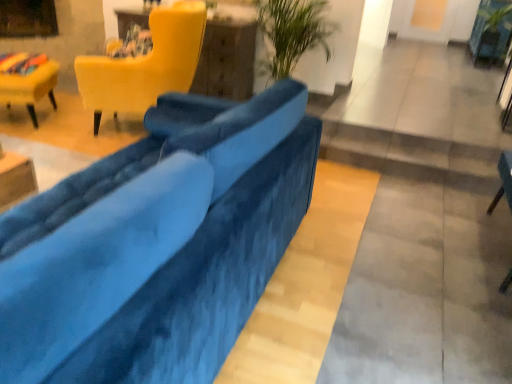
Measure the distance between point (481, 9) and camera.

Point (481, 9) is 6.29 meters away from camera.

Describe the element at coordinates (146, 64) in the screenshot. I see `velvet yellow chair at upper left, which is the 2th chair in left-to-right order` at that location.

What is the approximate height of velvet blue couch at center?

It is 92.53 centimeters.

Locate an element on the screen. The height and width of the screenshot is (384, 512). green leafy plant at upper right is located at coordinates (495, 17).

Consider the image. From their relative heights in the image, would you say velvet yellow chair at upper left, which is the 2th chair in left-to-right order, is taller or shorter than green leafy plant at upper right?

velvet yellow chair at upper left, which is the 2th chair in left-to-right order, is taller than green leafy plant at upper right.

From a real-world perspective, does velvet yellow chair at upper left, which is the 2th chair in left-to-right order, sit lower than green leafy plant at upper right?

Yes, from a real-world perspective, velvet yellow chair at upper left, which is the 2th chair in left-to-right order, is below green leafy plant at upper right.

In the scene shown: Is velvet yellow chair at upper left, which is the second chair from right to left, to the right of green leafy plant at upper right from the viewer's perspective?

In fact, velvet yellow chair at upper left, which is the second chair from right to left, is to the left of green leafy plant at upper right.

Locate an element on the screen. Image resolution: width=512 pixels, height=384 pixels. the 2nd chair in front when counting from the green leafy plant at upper right is located at coordinates (146, 64).

Would you say velvet blue chair at lower right, acting as the third chair starting from the left, is outside matte yellow chair at upper left?

Yes, velvet blue chair at lower right, acting as the third chair starting from the left, is located beyond the bounds of matte yellow chair at upper left.

Is velvet blue chair at lower right, acting as the third chair starting from the left, beside matte yellow chair at upper left?

No, velvet blue chair at lower right, acting as the third chair starting from the left, is not touching matte yellow chair at upper left.

Is velvet blue chair at lower right, acting as the first chair starting from the right, oriented away from matte yellow chair at upper left?

velvet blue chair at lower right, acting as the first chair starting from the right, does not have its back to matte yellow chair at upper left.

Considering the positions of objects velvet blue chair at lower right, acting as the first chair starting from the right, and matte yellow chair at upper left in the image provided, who is in front, velvet blue chair at lower right, acting as the first chair starting from the right, or matte yellow chair at upper left?

velvet blue chair at lower right, acting as the first chair starting from the right, is in front.

Are velvet yellow chair at left, arranged as the third chair when viewed from the right, and velvet blue chair at lower right, acting as the first chair starting from the right, located far from each other?

velvet yellow chair at left, arranged as the third chair when viewed from the right, is positioned a significant distance from velvet blue chair at lower right, acting as the first chair starting from the right.

From the image's perspective, is velvet yellow chair at left, arranged as the third chair when viewed from the right, on velvet blue chair at lower right, acting as the first chair starting from the right?

Yes, from the image's perspective, velvet yellow chair at left, arranged as the third chair when viewed from the right, is over velvet blue chair at lower right, acting as the first chair starting from the right.

Measure the distance between velvet yellow chair at left, arranged as the 1th chair when viewed from the left, and velvet blue chair at lower right, acting as the first chair starting from the right.

They are 3.72 meters apart.

Is velvet yellow chair at left, arranged as the 1th chair when viewed from the left, aimed at velvet blue chair at lower right, acting as the third chair starting from the left?

No, velvet yellow chair at left, arranged as the 1th chair when viewed from the left, is not aimed at velvet blue chair at lower right, acting as the third chair starting from the left.

From the matte yellow chair at upper left, count the 1st chair to the left and point to it. Please provide its 2D coordinates.

[(146, 64)]

Can matte yellow chair at upper left be found inside velvet yellow chair at upper left, which is the second chair from right to left?

No, matte yellow chair at upper left is not a part of velvet yellow chair at upper left, which is the second chair from right to left.

Does velvet yellow chair at upper left, which is the 2th chair in left-to-right order, turn towards matte yellow chair at upper left?

No, velvet yellow chair at upper left, which is the 2th chair in left-to-right order, is not aimed at matte yellow chair at upper left.

How many degrees apart are the facing directions of velvet yellow chair at upper left, which is the 2th chair in left-to-right order, and matte yellow chair at upper left?

The facing directions of velvet yellow chair at upper left, which is the 2th chair in left-to-right order, and matte yellow chair at upper left are 67.5 degrees apart.

From the image's perspective, relative to matte yellow chair at upper left, is velvet yellow chair at left, arranged as the 1th chair when viewed from the left, above or below?

From the image's perspective, velvet yellow chair at left, arranged as the 1th chair when viewed from the left, appears below matte yellow chair at upper left.

In the scene shown: Can you confirm if velvet yellow chair at left, arranged as the third chair when viewed from the right, is smaller than matte yellow chair at upper left?

Yes, velvet yellow chair at left, arranged as the third chair when viewed from the right, is smaller than matte yellow chair at upper left.

Considering the relative positions of velvet yellow chair at left, arranged as the 1th chair when viewed from the left, and matte yellow chair at upper left in the image provided, is velvet yellow chair at left, arranged as the 1th chair when viewed from the left, to the left of matte yellow chair at upper left from the viewer's perspective?

Indeed, velvet yellow chair at left, arranged as the 1th chair when viewed from the left, is positioned on the left side of matte yellow chair at upper left.

Can you tell me how much velvet yellow chair at left, arranged as the third chair when viewed from the right, and matte yellow chair at upper left differ in facing direction?

There is a 27.3-degree angle between the facing directions of velvet yellow chair at left, arranged as the third chair when viewed from the right, and matte yellow chair at upper left.

From a real-world perspective, relative to velvet blue couch at center, is velvet yellow chair at upper left, which is the 2th chair in left-to-right order, vertically above or below?

velvet yellow chair at upper left, which is the 2th chair in left-to-right order, is above velvet blue couch at center.

Which of these two, velvet yellow chair at upper left, which is the 2th chair in left-to-right order, or velvet blue couch at center, is bigger?

With larger size is velvet blue couch at center.

Considering the sizes of matte yellow chair at upper left and velvet blue couch at center in the image, is matte yellow chair at upper left bigger or smaller than velvet blue couch at center?

In the image, matte yellow chair at upper left appears to be smaller than velvet blue couch at center.

Considering their positions, is matte yellow chair at upper left located in front of or behind velvet blue couch at center?

matte yellow chair at upper left is positioned farther from the viewer than velvet blue couch at center.

Between matte yellow chair at upper left and velvet blue couch at center, which one has smaller width?

With smaller width is matte yellow chair at upper left.

Locate an element on the screen. The image size is (512, 384). studio couch that appears in front of the matte yellow chair at upper left is located at coordinates (161, 236).

The height and width of the screenshot is (384, 512). Find the location of `plant located above the velvet yellow chair at upper left, which is the 2th chair in left-to-right order (from a real-world perspective)`. plant located above the velvet yellow chair at upper left, which is the 2th chair in left-to-right order (from a real-world perspective) is located at coordinates (495, 17).

From a real-world perspective, starting from the matte yellow chair at upper left, which chair is the 1st one below it? Please provide its 2D coordinates.

[(504, 180)]

Estimate the real-world distances between objects in this image. Which object is further from velvet yellow chair at left, arranged as the 1th chair when viewed from the left, velvet blue couch at center or matte yellow chair at upper left?

Based on the image, velvet blue couch at center appears to be further to velvet yellow chair at left, arranged as the 1th chair when viewed from the left.

From the image, which object appears to be nearer to matte yellow chair at upper left, green leafy plant at upper right or velvet yellow chair at upper left, which is the 2th chair in left-to-right order?

velvet yellow chair at upper left, which is the 2th chair in left-to-right order.

Consider the image. From the image, which object appears to be farther from velvet yellow chair at upper left, which is the second chair from right to left, matte yellow chair at upper left or velvet blue chair at lower right, acting as the third chair starting from the left?

velvet blue chair at lower right, acting as the third chair starting from the left, is positioned further to the anchor velvet yellow chair at upper left, which is the second chair from right to left.

Based on their spatial positions, is matte yellow chair at upper left or velvet blue couch at center further from green leafy plant at upper right?

Based on the image, velvet blue couch at center appears to be further to green leafy plant at upper right.

From the image, which object appears to be farther from green leafy plant at upper right, velvet yellow chair at left, arranged as the third chair when viewed from the right, or velvet blue chair at lower right, acting as the first chair starting from the right?

velvet yellow chair at left, arranged as the third chair when viewed from the right, lies further to green leafy plant at upper right than the other object.

Considering their positions, is velvet blue chair at lower right, acting as the first chair starting from the right, positioned further to green leafy plant at upper right than matte yellow chair at upper left?

matte yellow chair at upper left lies further to green leafy plant at upper right than the other object.

From the image, which object appears to be farther from matte yellow chair at upper left, velvet yellow chair at left, arranged as the third chair when viewed from the right, or velvet blue chair at lower right, acting as the first chair starting from the right?

velvet blue chair at lower right, acting as the first chair starting from the right.

When comparing their distances from velvet blue chair at lower right, acting as the first chair starting from the right, does velvet yellow chair at upper left, which is the 2th chair in left-to-right order, or velvet yellow chair at left, arranged as the 1th chair when viewed from the left, seem further?

velvet yellow chair at left, arranged as the 1th chair when viewed from the left, is positioned further to the anchor velvet blue chair at lower right, acting as the first chair starting from the right.

The image size is (512, 384). Identify the location of studio couch between velvet yellow chair at upper left, which is the second chair from right to left, and velvet blue chair at lower right, acting as the third chair starting from the left, in the horizontal direction. (161, 236).

Identify the location of chair between velvet yellow chair at upper left, which is the second chair from right to left, and green leafy plant at upper right from left to right. The image size is (512, 384). (504, 180).

Where is `studio couch between velvet yellow chair at left, arranged as the 1th chair when viewed from the left, and green leafy plant at upper right, in the horizontal direction`? studio couch between velvet yellow chair at left, arranged as the 1th chair when viewed from the left, and green leafy plant at upper right, in the horizontal direction is located at coordinates (161, 236).

The image size is (512, 384). I want to click on chair between matte yellow chair at upper left and green leafy plant at upper right, so click(504, 180).